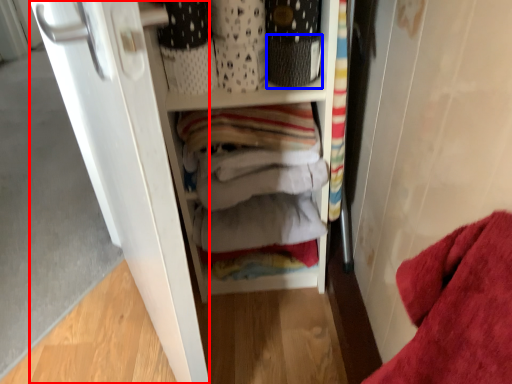
Question: Which object is closer to the camera taking this photo, door (highlighted by a red box) or basket (highlighted by a blue box)?

Choices:
 (A) door
 (B) basket

Answer: (A)